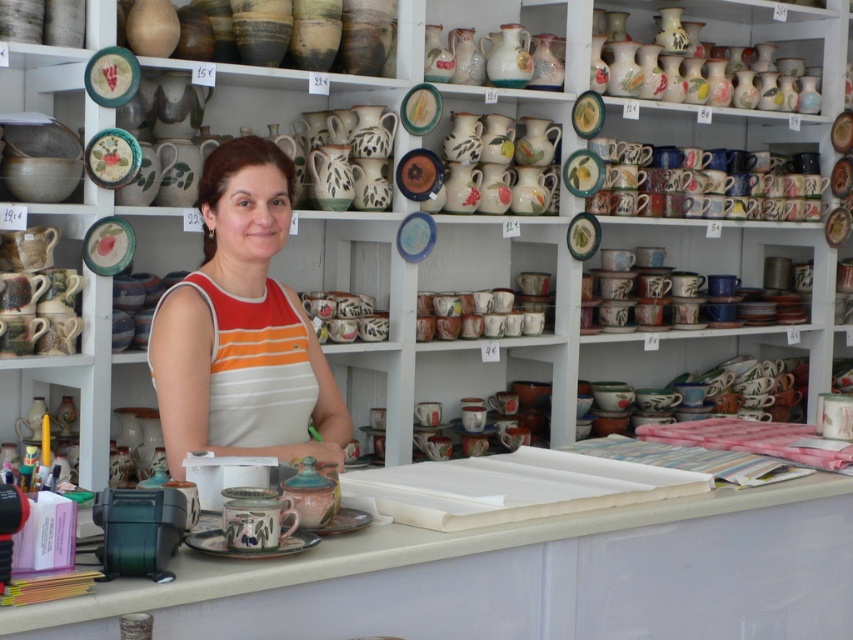
Question: Which point is closer to the camera taking this photo?

Choices:
 (A) (782, 536)
 (B) (254, 138)

Answer: (A)

Question: Which point is farther from the camera taking this photo?

Choices:
 (A) (280, 442)
 (B) (659, 609)

Answer: (A)

Question: Which of the following is the closest to the observer?

Choices:
 (A) orange striped tank top at center
 (B) white laminate counter at center
 (C) matte ceramic vases at upper center

Answer: (B)

Question: Observing the image, what is the correct spatial positioning of white laminate counter at center in reference to orange striped tank top at center?

Choices:
 (A) left
 (B) right

Answer: (B)

Question: Where is orange striped tank top at center located in relation to matte ceramic vases at upper right in the image?

Choices:
 (A) below
 (B) above

Answer: (A)

Question: Is matte ceramic vases at upper right positioned before matte ceramic vases at upper center?

Choices:
 (A) no
 (B) yes

Answer: (A)